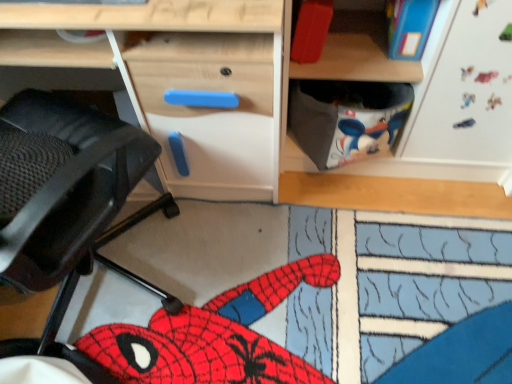
This screenshot has width=512, height=384. What do you see at coordinates (182, 80) in the screenshot?
I see `wooden desk at center` at bounding box center [182, 80].

At what (x,y) coordinates should I click in order to perform the action: click on wooden desk at center. Please return your answer as a coordinate pair (x, y). This screenshot has height=384, width=512. Looking at the image, I should click on (182, 80).

What is the approximate height of wooden desk at center?

It is 31.25 inches.

What do you see at coordinates (76, 193) in the screenshot? This screenshot has height=384, width=512. I see `black mesh swivel chair at left` at bounding box center [76, 193].

Image resolution: width=512 pixels, height=384 pixels. What are the coordinates of `black mesh swivel chair at left` in the screenshot? It's located at (76, 193).

Locate an element on the screen. The image size is (512, 384). wooden desk at center is located at coordinates (182, 80).

Is black mesh swivel chair at left at the left side of wooden desk at center?

Yes, black mesh swivel chair at left is to the left of wooden desk at center.

Based on the photo, considering the positions of objects black mesh swivel chair at left and wooden desk at center in the image provided, who is in front, black mesh swivel chair at left or wooden desk at center?

black mesh swivel chair at left is closer to the camera.

Does point (106, 264) appear closer or farther from the camera than point (210, 127)?

Clearly, point (106, 264) is more distant from the camera than point (210, 127).

From the image's perspective, is black mesh swivel chair at left over wooden desk at center?

No, from the image's perspective, black mesh swivel chair at left is not over wooden desk at center.

From a real-world perspective, is black mesh swivel chair at left above or below wooden desk at center?

black mesh swivel chair at left is situated higher than wooden desk at center in the real world.

Does black mesh swivel chair at left have a greater width compared to wooden desk at center?

Yes.

Can you confirm if black mesh swivel chair at left is shorter than wooden desk at center?

No, black mesh swivel chair at left is not shorter than wooden desk at center.

Between black mesh swivel chair at left and wooden desk at center, which one has smaller size?

wooden desk at center is smaller.

Is black mesh swivel chair at left not within wooden desk at center?

Indeed, black mesh swivel chair at left is completely outside wooden desk at center.

Are black mesh swivel chair at left and wooden desk at center beside each other?

No, black mesh swivel chair at left is not touching wooden desk at center.

Is black mesh swivel chair at left facing towards wooden desk at center?

Yes, black mesh swivel chair at left faces towards wooden desk at center.

Can you tell me how much black mesh swivel chair at left and wooden desk at center differ in facing direction?

148 degrees separate the facing orientations of black mesh swivel chair at left and wooden desk at center.

Locate an element on the screen. The image size is (512, 384). swivel chair above the wooden desk at center (from a real-world perspective) is located at coordinates (76, 193).

Between wooden desk at center and black mesh swivel chair at left, which one appears on the right side from the viewer's perspective?

wooden desk at center.

Which object is closer to the camera, wooden desk at center or black mesh swivel chair at left?

Positioned in front is black mesh swivel chair at left.

Is point (170, 119) more distant than point (35, 208)?

Yes.

Consider the image. From the image's perspective, is wooden desk at center on top of black mesh swivel chair at left?

Correct, wooden desk at center appears higher than black mesh swivel chair at left in the image.

From a real-world perspective, who is located lower, wooden desk at center or black mesh swivel chair at left?

wooden desk at center is physically lower.

Can you confirm if wooden desk at center is wider than black mesh swivel chair at left?

No, wooden desk at center is not wider than black mesh swivel chair at left.

Can you confirm if wooden desk at center is taller than black mesh swivel chair at left?

Incorrect, the height of wooden desk at center is not larger of that of black mesh swivel chair at left.

In the scene shown: Looking at the image, does wooden desk at center seem bigger or smaller compared to black mesh swivel chair at left?

wooden desk at center is smaller than black mesh swivel chair at left.

Is wooden desk at center outside of black mesh swivel chair at left?

wooden desk at center is positioned outside black mesh swivel chair at left.

Is wooden desk at center not near black mesh swivel chair at left?

No, wooden desk at center is in close proximity to black mesh swivel chair at left.

Is wooden desk at center oriented away from black mesh swivel chair at left?

No, black mesh swivel chair at left is not at the back of wooden desk at center.

How many degrees apart are the facing directions of wooden desk at center and black mesh swivel chair at left?

The angular difference between wooden desk at center and black mesh swivel chair at left is 148 degrees.

This screenshot has height=384, width=512. In order to click on desk directly beneath the black mesh swivel chair at left (from a real-world perspective) in this screenshot , I will do `click(182, 80)`.

Locate an element on the screen. This screenshot has height=384, width=512. swivel chair on the left side of wooden desk at center is located at coordinates (76, 193).

Find the location of a particular element. This screenshot has height=384, width=512. desk on the right of black mesh swivel chair at left is located at coordinates (182, 80).